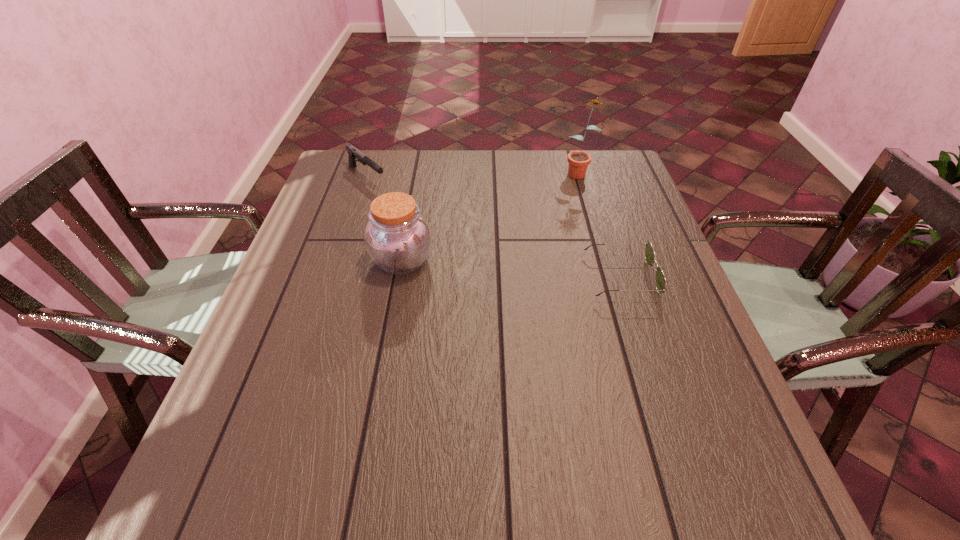
The image size is (960, 540). Identify the location of free space located at the muzzle end of the second shortest object. (448, 242).

Where is `vacant space located at the muzzle end of the second shortest object`? The image size is (960, 540). vacant space located at the muzzle end of the second shortest object is located at coordinates (390, 196).

You are a GUI agent. You are given a task and a screenshot of the screen. Output one action in this format:
    pyautogui.click(x=<x>, y=<y>)
    Task: Click on the free spot located 0.190m at the muzzle end of the second shortest object
    Image resolution: width=960 pixels, height=540 pixels.
    Given the screenshot: What is the action you would take?
    pyautogui.click(x=416, y=217)

Identify the location of sunflower that is at the far edge. (578, 161).

Where is `gun present at the far edge`? gun present at the far edge is located at coordinates (353, 153).

Image resolution: width=960 pixels, height=540 pixels. I want to click on object that is at the left edge, so click(x=353, y=153).

Find the location of a particular element. This screenshot has height=540, width=960. sunglasses located in the right edge section of the desktop is located at coordinates (660, 281).

Where is `sunflower situated at the right edge`? This screenshot has width=960, height=540. sunflower situated at the right edge is located at coordinates (578, 161).

The width and height of the screenshot is (960, 540). What are the coordinates of `object at the far left corner` in the screenshot? It's located at (353, 153).

The height and width of the screenshot is (540, 960). What are the coordinates of `object at the far right corner` in the screenshot? It's located at (578, 161).